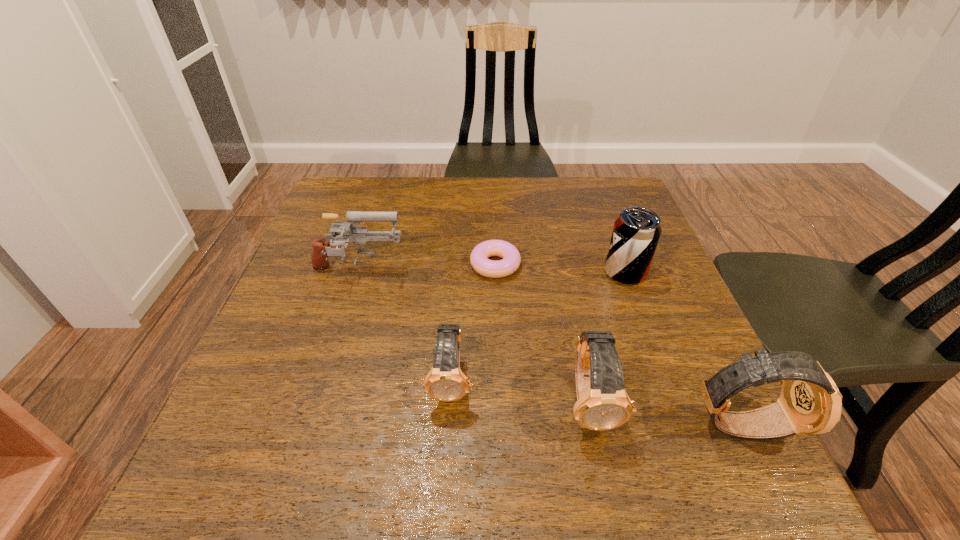
Locate an element on the screen. This screenshot has width=960, height=540. free space at the near right corner is located at coordinates (658, 423).

Identify the location of vacant point located between the leftmost object and the fourth object from left to right. (474, 336).

Locate an element on the screen. The image size is (960, 540). vacant area that lies between the second tallest watch and the doughnut is located at coordinates (542, 333).

You are a GUI agent. You are given a task and a screenshot of the screen. Output one action in this format:
    pyautogui.click(x=<x>, y=<y>)
    Task: Click on the free space between the second watch from right to left and the doughnut
    The image size is (960, 540).
    Given the screenshot: What is the action you would take?
    pyautogui.click(x=542, y=333)

Where is `free space between the doughnut and the soda can`? Image resolution: width=960 pixels, height=540 pixels. free space between the doughnut and the soda can is located at coordinates (560, 269).

This screenshot has width=960, height=540. Find the location of `free area in between the rightmost watch and the second shortest watch`. free area in between the rightmost watch and the second shortest watch is located at coordinates (665, 413).

This screenshot has height=540, width=960. What are the coordinates of `empty space between the gun and the third object from right to left` in the screenshot? It's located at (474, 336).

Identify the location of free space that is in between the leftmost watch and the third object from right to left. The width and height of the screenshot is (960, 540). (521, 392).

Where is `empty space between the soda can and the doughnut`? This screenshot has height=540, width=960. empty space between the soda can and the doughnut is located at coordinates pyautogui.click(x=560, y=269).

This screenshot has height=540, width=960. Find the location of `free space that is in between the gun and the fifth tallest object`. free space that is in between the gun and the fifth tallest object is located at coordinates (405, 326).